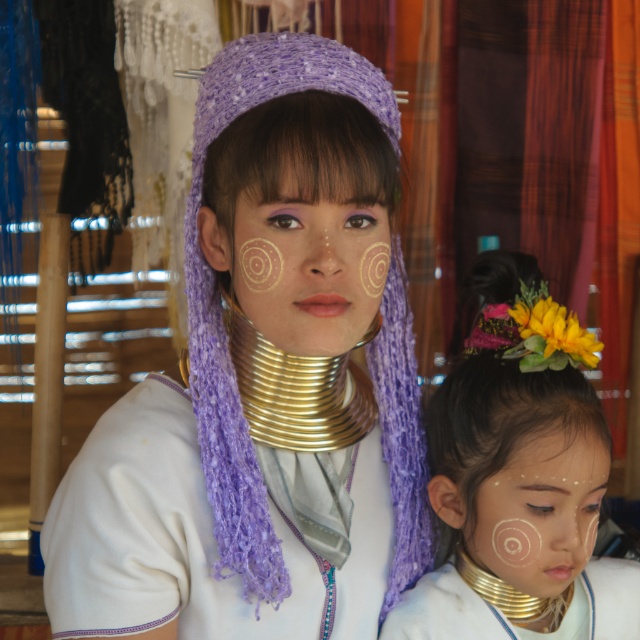
You are an anthropologist studying the spatial arrangement of traditional adornments. You observe two points on the individual in the image. Which point, point (481, 272) or point (582, 577), is positioned closer to your perspective as an observer?

Point (481, 272) is closer to the viewer than point (582, 577).

You are a photographer standing 1.5 meters away from the subject. You want to take a closeup shot of the circular patterns on their cheeks. Is the point at coordinates point (554, 436) within your focus range if your camera has a minimum focusing distance of 1.0 meters?

The distance of point (554, 436) from camera is 1.13 meters, which is within the camera minimum focusing distance of 1.0 meters. So yes, the camera can focus on the point (554, 436).

Based on the scene description, which object has a smaller width between the white matte face paint at center and the gold metallic neck rings at lower center?

The white matte face paint at center has a smaller width than the gold metallic neck rings at lower center.